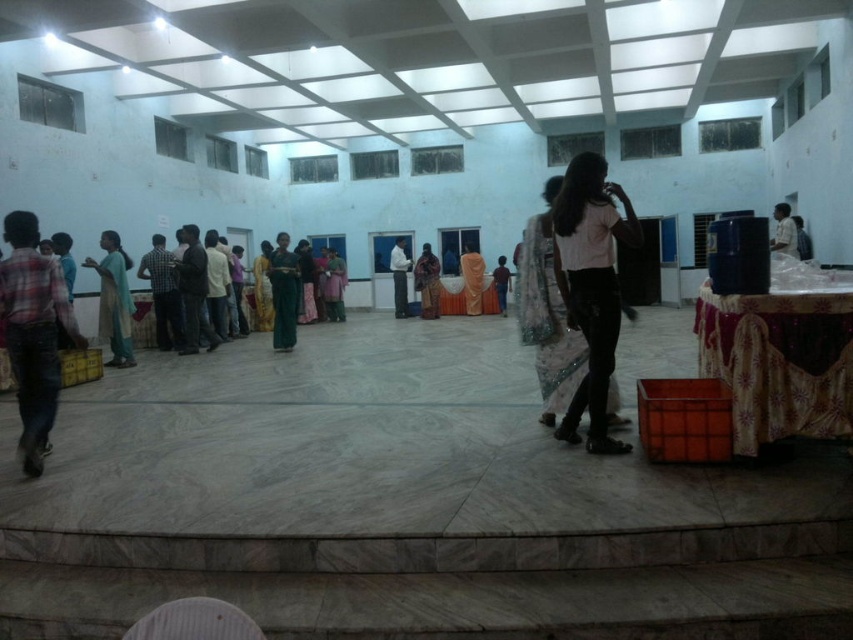
You are organizing a photo shoot and need to place two items in the scene described. You have a white lace saree at center and a dark blue shirt at center. Given their sizes, which item should you adjust to ensure they both fit within the frame without overlapping?

The white lace saree at center is smaller than the dark blue shirt at center. To ensure both items fit without overlapping, you should adjust the placement of the larger item, the dark blue shirt at center, since it requires more space.

You are attending a cultural event and see two people wearing a white lace saree at center and a dark blue shirt at center. Which clothing item is positioned lower in the image?

The white lace saree at center is positioned below the dark blue shirt at center, so it is lower in the image.